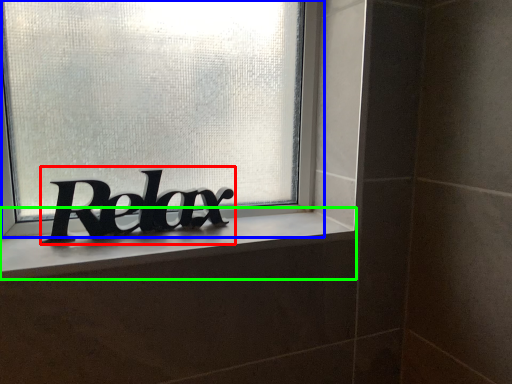
Question: Based on their relative distances, which object is farther from lettering (highlighted by a red box)? Choose from window (highlighted by a blue box) and window sill (highlighted by a green box).

Choices:
 (A) window
 (B) window sill

Answer: (A)